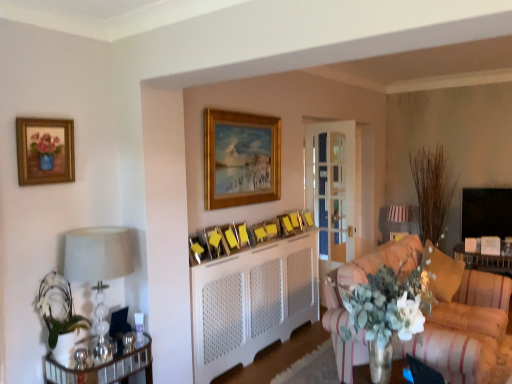
The image size is (512, 384). Find the location of `free space above white glass lampshade at left, the 2th lamp from the right (from a real-world perspective)`. free space above white glass lampshade at left, the 2th lamp from the right (from a real-world perspective) is located at coordinates (95, 233).